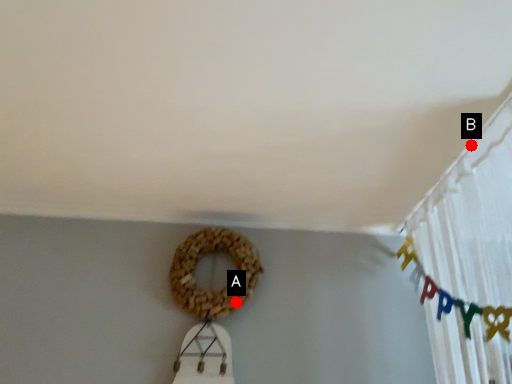
Question: Two points are circled on the image, labeled by A and B beside each circle. Which point is closer to the camera?

Choices:
 (A) A is closer
 (B) B is closer

Answer: (B)